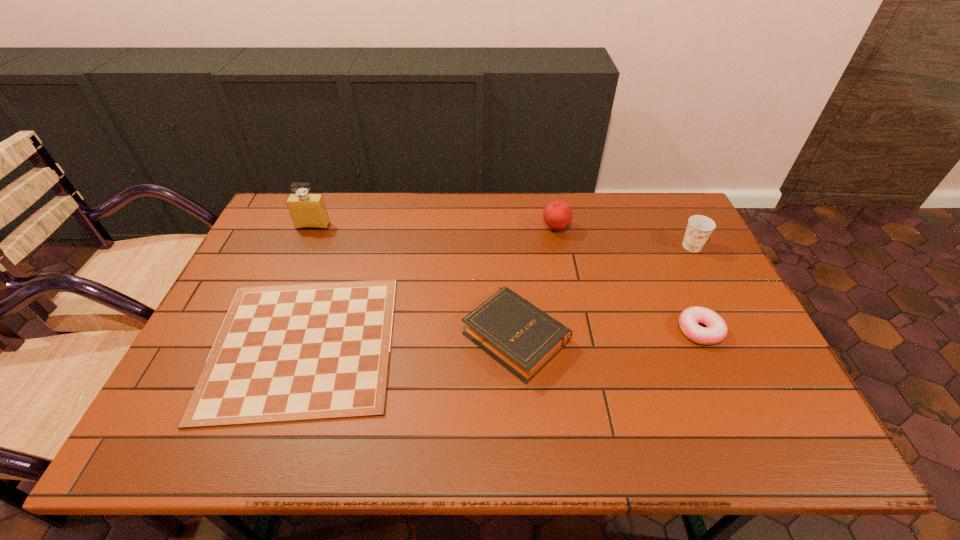
Image resolution: width=960 pixels, height=540 pixels. In order to click on object positioned at the near left corner in this screenshot , I will do `click(299, 352)`.

This screenshot has height=540, width=960. In the image, there is a desktop. Identify the location of free space at the far edge. (391, 215).

In the image, there is a desktop. Where is `vacant area at the near edge`? The width and height of the screenshot is (960, 540). vacant area at the near edge is located at coordinates (519, 437).

This screenshot has width=960, height=540. Find the location of `vacant area at the left edge of the desktop`. vacant area at the left edge of the desktop is located at coordinates (265, 268).

The height and width of the screenshot is (540, 960). I want to click on vacant space at the right edge of the desktop, so click(x=789, y=411).

In order to click on vacant space at the far right corner of the desktop in this screenshot , I will do `click(679, 208)`.

In the image, there is a desktop. Where is `blank space at the near right corner`? blank space at the near right corner is located at coordinates (740, 454).

The image size is (960, 540). I want to click on vacant space that's between the fourth tallest object and the tallest object, so click(415, 281).

Find the location of `free space between the apple and the checkerboard`. free space between the apple and the checkerboard is located at coordinates (429, 286).

Identify the location of free space between the Dixie cup and the perfume. point(502,236).